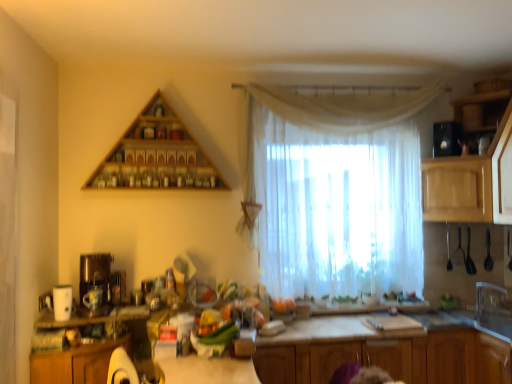
What do you see at coordinates (76, 363) in the screenshot? I see `wooden cabinet at lower left, the first cabinetry from the left` at bounding box center [76, 363].

The height and width of the screenshot is (384, 512). Identify the location of wooden cabinet at lower left, the fifth cabinetry from the right. (76, 363).

Identify the location of metallic silver toaster at center, which is counted as the 2th appliance, starting from the back. (117, 286).

Where is `light brown wood cabinet at right, acting as the 3th cabinetry starting from the right`? The width and height of the screenshot is (512, 384). light brown wood cabinet at right, acting as the 3th cabinetry starting from the right is located at coordinates (457, 189).

Where is `matte brown coffee machine at left`? The image size is (512, 384). matte brown coffee machine at left is located at coordinates (95, 275).

The width and height of the screenshot is (512, 384). What do you see at coordinates (95, 275) in the screenshot? I see `matte brown coffee machine at left` at bounding box center [95, 275].

In order to face light wood cabinet at upper right, arranged as the first cabinetry when viewed from the right, should I rotate leftwards or rightwards?

Turn right approximately 30.329 degrees to face it.

This screenshot has height=384, width=512. I want to click on white matte coffee maker at left, the 1th appliance when ordered from left to right, so pyautogui.click(x=62, y=302).

Measure the distance between point (485, 284) and camera.

Point (485, 284) is 3.23 meters from camera.

Locate an element on the screen. clear plastic faucet at right is located at coordinates (482, 296).

Image resolution: width=512 pixels, height=384 pixels. I want to click on wooden cabinet at lower left, the first cabinetry from the left, so click(x=76, y=363).

Between clear plastic faucet at right and light brown wood cabinet at right, acting as the 3th cabinetry starting from the right, which one has smaller size?

clear plastic faucet at right.

From the image's perspective, does clear plastic faucet at right appear higher than light brown wood cabinet at right, which is the 3th cabinetry in left-to-right order?

No, from the image's perspective, clear plastic faucet at right is not on top of light brown wood cabinet at right, which is the 3th cabinetry in left-to-right order.

Which object is positioned more to the left, clear plastic faucet at right or light brown wood cabinet at right, which is the 3th cabinetry in left-to-right order?

Positioned to the left is light brown wood cabinet at right, which is the 3th cabinetry in left-to-right order.

Can you confirm if clear plastic faucet at right is taller than light brown wood cabinet at right, which is the 3th cabinetry in left-to-right order?

No.

Can you tell me how much wooden cabinet at lower left, the first cabinetry from the left, and matte brown coffee machine at left differ in facing direction?

The facing directions of wooden cabinet at lower left, the first cabinetry from the left, and matte brown coffee machine at left are 14.3 degrees apart.

Based on their sizes in the image, would you say wooden cabinet at lower left, the fifth cabinetry from the right, is bigger or smaller than matte brown coffee machine at left?

Clearly, wooden cabinet at lower left, the fifth cabinetry from the right, is larger in size than matte brown coffee machine at left.

Are wooden cabinet at lower left, the first cabinetry from the left, and matte brown coffee machine at left making contact?

No, wooden cabinet at lower left, the first cabinetry from the left, is not next to matte brown coffee machine at left.

From a real-world perspective, relative to matte brown coffee machine at left, is wooden cabinet at lower left, the fifth cabinetry from the right, vertically above or below?

wooden cabinet at lower left, the fifth cabinetry from the right, is below matte brown coffee machine at left.

Locate an element on the screen. The width and height of the screenshot is (512, 384). the 3rd cabinetry behind the wooden cabinets at center, arranged as the 4th cabinetry when viewed from the right is located at coordinates (490, 359).

Considering their positions, is wooden cabinet at lower right, placed as the 4th cabinetry when sorted from left to right, located in front of or behind wooden cabinets at center, acting as the second cabinetry starting from the left?

Visually, wooden cabinet at lower right, placed as the 4th cabinetry when sorted from left to right, is located behind wooden cabinets at center, acting as the second cabinetry starting from the left.

Who is taller, wooden cabinet at lower right, placed as the second cabinetry when sorted from right to left, or wooden cabinets at center, acting as the second cabinetry starting from the left?

wooden cabinets at center, acting as the second cabinetry starting from the left, is taller.

Is point (487, 371) behind point (341, 317)?

No, (487, 371) is in front of (341, 317).

Is clear plastic faucet at right facing towards wooden cabinets at center, arranged as the 4th cabinetry when viewed from the right?

Yes.

Is clear plastic faucet at right not within wooden cabinets at center, arranged as the 4th cabinetry when viewed from the right?

clear plastic faucet at right lies outside wooden cabinets at center, arranged as the 4th cabinetry when viewed from the right,'s area.

From the image's perspective, is clear plastic faucet at right located above wooden cabinets at center, arranged as the 4th cabinetry when viewed from the right?

Yes, from the image's perspective, clear plastic faucet at right is over wooden cabinets at center, arranged as the 4th cabinetry when viewed from the right.

Does point (478, 302) come behind point (476, 377)?

Yes.

Looking at the image, does white sheer curtain at center seem bigger or smaller compared to light wood cabinet at upper right, which is counted as the 5th cabinetry, starting from the left?

Considering their sizes, white sheer curtain at center takes up less space than light wood cabinet at upper right, which is counted as the 5th cabinetry, starting from the left.

Considering the points (297, 249) and (463, 159), which point is in front, point (297, 249) or point (463, 159)?

The point (297, 249) is more forward.

Is white sheer curtain at center to the right of light wood cabinet at upper right, which is counted as the 5th cabinetry, starting from the left, from the viewer's perspective?

No, white sheer curtain at center is not to the right of light wood cabinet at upper right, which is counted as the 5th cabinetry, starting from the left.

Do you think white sheer curtain at center is within light wood cabinet at upper right, which is counted as the 5th cabinetry, starting from the left, or outside of it?

white sheer curtain at center lies outside light wood cabinet at upper right, which is counted as the 5th cabinetry, starting from the left.

Can you tell me how much wooden cabinets at center, acting as the second cabinetry starting from the left, and wooden cabinet at lower right, placed as the second cabinetry when sorted from right to left, differ in facing direction?

The facing directions of wooden cabinets at center, acting as the second cabinetry starting from the left, and wooden cabinet at lower right, placed as the second cabinetry when sorted from right to left, are 108 degrees apart.

In the scene shown: Can you see wooden cabinets at center, arranged as the 4th cabinetry when viewed from the right, touching wooden cabinet at lower right, placed as the second cabinetry when sorted from right to left?

wooden cabinets at center, arranged as the 4th cabinetry when viewed from the right, and wooden cabinet at lower right, placed as the second cabinetry when sorted from right to left, are clearly separated.

Looking at the image, does wooden cabinets at center, arranged as the 4th cabinetry when viewed from the right, seem bigger or smaller compared to wooden cabinet at lower right, placed as the second cabinetry when sorted from right to left?

In the image, wooden cabinets at center, arranged as the 4th cabinetry when viewed from the right, appears to be larger than wooden cabinet at lower right, placed as the second cabinetry when sorted from right to left.

Can you confirm if wooden cabinets at center, acting as the second cabinetry starting from the left, is thinner than wooden cabinet at lower right, placed as the second cabinetry when sorted from right to left?

In fact, wooden cabinets at center, acting as the second cabinetry starting from the left, might be wider than wooden cabinet at lower right, placed as the second cabinetry when sorted from right to left.

Looking at this image, how distant is metallic silver toaster at center, which is counted as the 2th appliance, starting from the back, from light wood cabinet at upper right, arranged as the first cabinetry when viewed from the right?

metallic silver toaster at center, which is counted as the 2th appliance, starting from the back, and light wood cabinet at upper right, arranged as the first cabinetry when viewed from the right, are 2.43 meters apart from each other.

Is the surface of metallic silver toaster at center, which is counted as the 2th appliance, starting from the back, in direct contact with light wood cabinet at upper right, which is counted as the 5th cabinetry, starting from the left?

No, metallic silver toaster at center, which is counted as the 2th appliance, starting from the back, is not making contact with light wood cabinet at upper right, which is counted as the 5th cabinetry, starting from the left.

Is metallic silver toaster at center, acting as the second appliance starting from the right, taller or shorter than light wood cabinet at upper right, arranged as the first cabinetry when viewed from the right?

Clearly, metallic silver toaster at center, acting as the second appliance starting from the right, is shorter compared to light wood cabinet at upper right, arranged as the first cabinetry when viewed from the right.

Where is `cabinetry behind the clear plastic faucet at right`? cabinetry behind the clear plastic faucet at right is located at coordinates (457, 189).

This screenshot has height=384, width=512. What are the coordinates of `the 3rd cabinetry directly beneath the matte brown coffee machine at left (from a real-world perspective)` in the screenshot? It's located at (76, 363).

Based on the photo, which object lies further to the anchor point wooden cabinet at lower right, placed as the 4th cabinetry when sorted from left to right, black glossy microwave at upper right, which ranks as the third appliance in bottom-to-top order, or white sheer curtain at center?

black glossy microwave at upper right, which ranks as the third appliance in bottom-to-top order, is positioned further to the anchor wooden cabinet at lower right, placed as the 4th cabinetry when sorted from left to right.

Which object lies nearer to the anchor point metallic silver toaster at center, the 2th appliance in the front-to-back sequence, white sheer curtain at center or clear plastic faucet at right?

Among the two, white sheer curtain at center is located nearer to metallic silver toaster at center, the 2th appliance in the front-to-back sequence.

From the image, which object appears to be farther from light brown wood cabinet at right, which is the 3th cabinetry in left-to-right order, wooden cabinet at lower left, the first cabinetry from the left, or white matte coffee maker at left, the 3th appliance positioned from the right?

Among the two, white matte coffee maker at left, the 3th appliance positioned from the right, is located further to light brown wood cabinet at right, which is the 3th cabinetry in left-to-right order.

Looking at the image, which one is located closer to white sheer curtain at center, wooden cabinets at center, arranged as the 4th cabinetry when viewed from the right, or wooden cabinet at lower left, the first cabinetry from the left?

wooden cabinets at center, arranged as the 4th cabinetry when viewed from the right, lies closer to white sheer curtain at center than the other object.

Which object lies further to the anchor point wooden cabinets at center, arranged as the 4th cabinetry when viewed from the right, light wood cabinet at upper right, which is counted as the 5th cabinetry, starting from the left, or wooden cabinet at lower right, placed as the 4th cabinetry when sorted from left to right?

light wood cabinet at upper right, which is counted as the 5th cabinetry, starting from the left, is positioned further to the anchor wooden cabinets at center, arranged as the 4th cabinetry when viewed from the right.

Based on their spatial positions, is light brown wood cabinet at right, which is the 3th cabinetry in left-to-right order, or matte brown coffee machine at left closer to light wood cabinet at upper right, arranged as the first cabinetry when viewed from the right?

Based on the image, light brown wood cabinet at right, which is the 3th cabinetry in left-to-right order, appears to be nearer to light wood cabinet at upper right, arranged as the first cabinetry when viewed from the right.

When comparing their distances from clear plastic faucet at right, does white matte coffee maker at left, the 1th appliance viewed from the front, or light brown wood cabinet at right, acting as the 3th cabinetry starting from the right, seem closer?

The object closer to clear plastic faucet at right is light brown wood cabinet at right, acting as the 3th cabinetry starting from the right.

Considering their positions, is wooden cabinet at lower right, placed as the second cabinetry when sorted from right to left, positioned closer to white sheer curtain at center than clear plastic faucet at right?

wooden cabinet at lower right, placed as the second cabinetry when sorted from right to left, lies closer to white sheer curtain at center than the other object.

Identify the location of coffee machine between wooden cabinet at lower left, the first cabinetry from the left, and white sheer curtain at center, in the horizontal direction. (95, 275).

This screenshot has width=512, height=384. What are the coordinates of `coffee machine located between wooden cabinet at lower left, the fifth cabinetry from the right, and wooden cabinet at lower right, placed as the second cabinetry when sorted from right to left, in the left-right direction` in the screenshot? It's located at (95, 275).

The height and width of the screenshot is (384, 512). Identify the location of cabinetry between wooden cabinet at lower left, the fifth cabinetry from the right, and black glossy microwave at upper right, the third appliance viewed from the front. (384, 352).

Locate an element on the screen. Image resolution: width=512 pixels, height=384 pixels. curtain between wooden triangle at upper center and light wood cabinet at upper right, which is counted as the 5th cabinetry, starting from the left, from left to right is located at coordinates (335, 208).